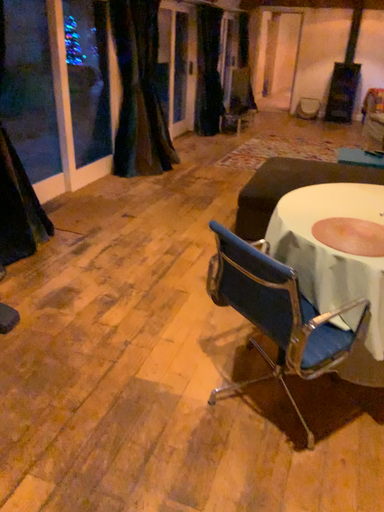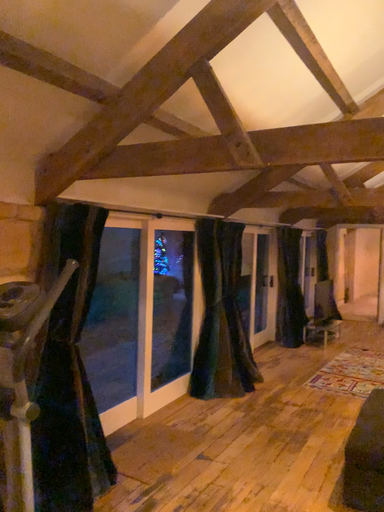
Question: Which way did the camera rotate in the video?

Choices:
 (A) rotated right
 (B) rotated left

Answer: (B)